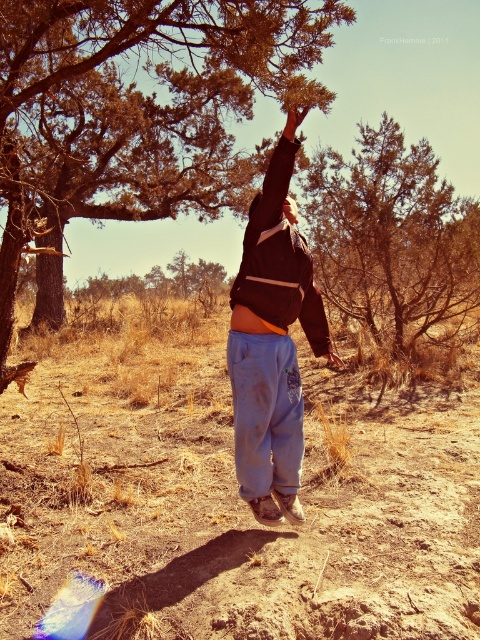
Image resolution: width=480 pixels, height=640 pixels. Identify the location of black matte arm at upper center. (292, 124).

The width and height of the screenshot is (480, 640). Find the location of `black matte arm at upper center`. black matte arm at upper center is located at coordinates (292, 124).

Is dried grass at center thinner than smooth skin hand at upper center?

In fact, dried grass at center might be wider than smooth skin hand at upper center.

Is dried grass at center to the right of smooth skin hand at upper center from the viewer's perspective?

Incorrect, dried grass at center is not on the right side of smooth skin hand at upper center.

The width and height of the screenshot is (480, 640). What are the coordinates of `dried grass at center` in the screenshot? It's located at (233, 499).

Does dried grass at center have a larger size compared to black matte arm at upper center?

Indeed, dried grass at center has a larger size compared to black matte arm at upper center.

Is dried grass at center below black matte arm at upper center?

Correct, dried grass at center is located below black matte arm at upper center.

Is point (140, 452) positioned before point (296, 212)?

No, (140, 452) is behind (296, 212).

Identify the location of dried grass at center. Image resolution: width=480 pixels, height=640 pixels. (233, 499).